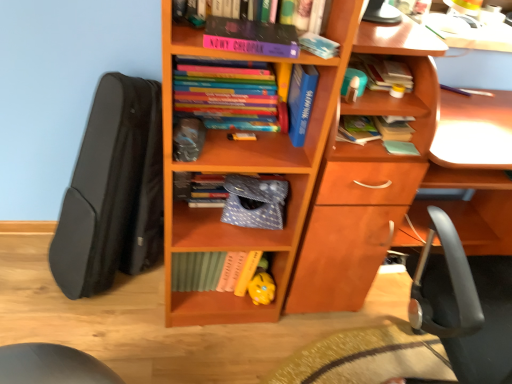
Question: From a real-world perspective, is blue hardcover book at upper center, the 3th book positioned from the left, physically below hardcover book at upper right, which ranks as the sixth book in left-to-right order?

Choices:
 (A) yes
 (B) no

Answer: (A)

Question: From the image's perspective, is blue hardcover book at upper center, the 3th book positioned from the left, above hardcover book at upper right, arranged as the second book when viewed from the right?

Choices:
 (A) no
 (B) yes

Answer: (A)

Question: Considering the relative sizes of blue hardcover book at upper center, which is the fifth book in right-to-left order, and hardcover book at upper right, which ranks as the sixth book in left-to-right order, in the image provided, is blue hardcover book at upper center, which is the fifth book in right-to-left order, taller than hardcover book at upper right, which ranks as the sixth book in left-to-right order,?

Choices:
 (A) yes
 (B) no

Answer: (A)

Question: Is blue hardcover book at upper center, which is the fifth book in right-to-left order, facing away from hardcover book at upper right, arranged as the second book when viewed from the right?

Choices:
 (A) no
 (B) yes

Answer: (A)

Question: Can you see blue hardcover book at upper center, the 3th book positioned from the left, touching hardcover book at upper right, arranged as the second book when viewed from the right?

Choices:
 (A) no
 (B) yes

Answer: (A)

Question: In the image, is purple matte book at upper center, which ranks as the 7th book in right-to-left order, on the left side or the right side of hardcover book at upper right, which is the 1th book from right to left?

Choices:
 (A) left
 (B) right

Answer: (A)

Question: From their relative heights in the image, would you say purple matte book at upper center, which ranks as the 7th book in right-to-left order, is taller or shorter than hardcover book at upper right, which is the 1th book from right to left?

Choices:
 (A) tall
 (B) short

Answer: (A)

Question: Considering the positions of purple matte book at upper center, which ranks as the 1th book in left-to-right order, and hardcover book at upper right, positioned as the seventh book in left-to-right order, in the image, is purple matte book at upper center, which ranks as the 1th book in left-to-right order, wider or thinner than hardcover book at upper right, positioned as the seventh book in left-to-right order,?

Choices:
 (A) wide
 (B) thin

Answer: (A)

Question: Is point pos(241,87) closer or farther from the camera than point pos(394,135)?

Choices:
 (A) closer
 (B) farther

Answer: (A)

Question: In terms of size, does blue hardcover book at upper center, which is the fifth book in right-to-left order, appear bigger or smaller than black matte guitar case at left?

Choices:
 (A) big
 (B) small

Answer: (B)

Question: Visually, is blue hardcover book at upper center, which is the fifth book in right-to-left order, positioned to the left or to the right of black matte guitar case at left?

Choices:
 (A) right
 (B) left

Answer: (A)

Question: Looking at their shapes, would you say blue hardcover book at upper center, the 3th book positioned from the left, is wider or thinner than black matte guitar case at left?

Choices:
 (A) wide
 (B) thin

Answer: (B)

Question: Is blue hardcover book at upper center, which is the fifth book in right-to-left order, inside or outside of black matte guitar case at left?

Choices:
 (A) outside
 (B) inside

Answer: (A)

Question: Is point (260, 276) positioned closer to the camera than point (371, 67)?

Choices:
 (A) farther
 (B) closer

Answer: (A)

Question: Is yellow matte piggy bank at lower center in front of or behind hardcover book at upper right, arranged as the second book when viewed from the right, in the image?

Choices:
 (A) front
 (B) behind

Answer: (B)